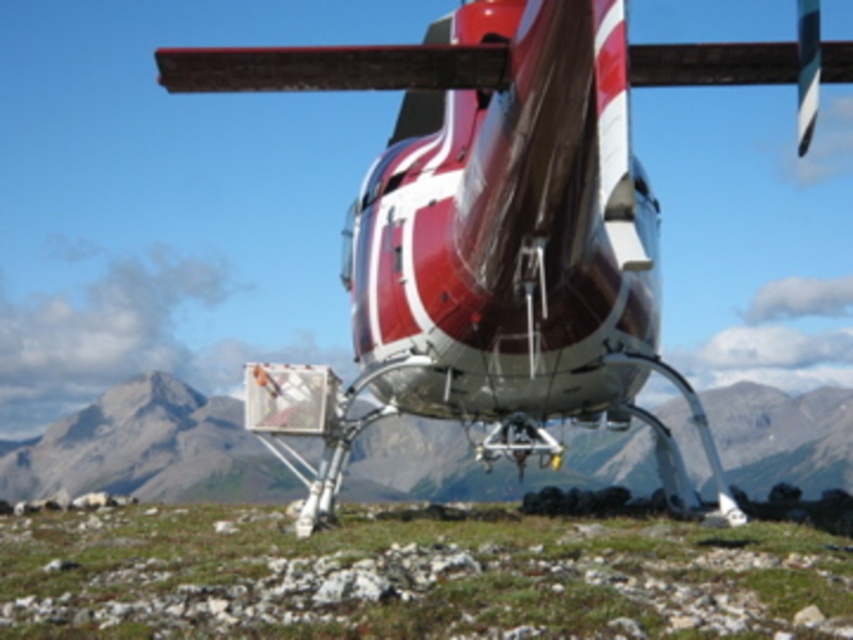
You are a pilot flying a helicopter. You notice a shiny metallic helicopter at center and a matte gray rock at center below you. Which object is closer to your current altitude?

The shiny metallic helicopter at center is much taller than the matte gray rock at center, so it is closer to your current altitude.

You are a drone pilot flying a drone over the mountainous terrain. You notice two points marked on your map at coordinates point (422, 124) and point (773, 589). According to the image, which point is closer to the helicopter?

Point (773, 589) is closer to the helicopter because point (422, 124) is behind it.

You are a pilot flying a helicopter. You notice a shiny metallic helicopter at center and green grass at center in your view. Which object appears bigger in your view?

The shiny metallic helicopter at center appears bigger than the green grass at center because it is larger in size according to the description.